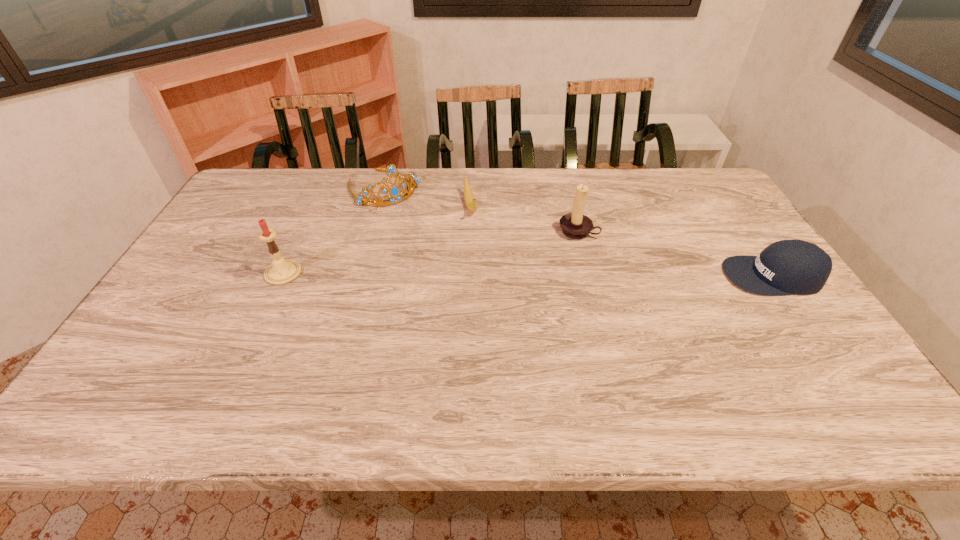
Find the location of a particular element. This screenshot has height=540, width=960. vacant space on the desktop that is between the leftmost object and the fourth tallest object and is positioned on the wick of the candle holder is located at coordinates (546, 275).

The image size is (960, 540). Identify the location of vacant space on the desktop that is between the leftmost object and the fourth tallest object and is positioned at the stem of the third object from right to left. (492, 274).

Find the location of a particular element. The image size is (960, 540). free space on the desktop that is between the candle and the rightmost object and is positioned on the front-facing side of the third tallest object is located at coordinates (459, 274).